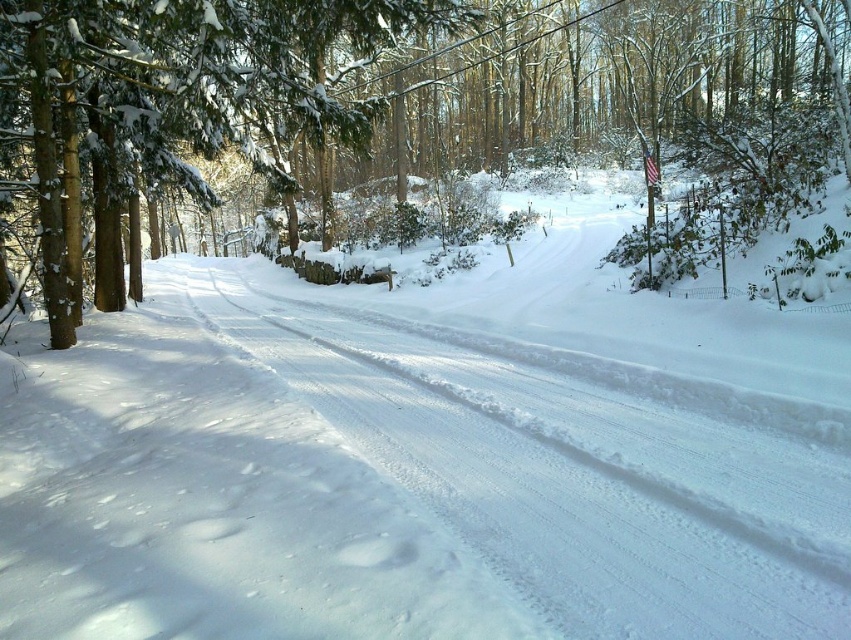
Who is positioned more to the left, white snow trail at center or snow-covered evergreen tree at left?

From the viewer's perspective, snow-covered evergreen tree at left appears more on the left side.

The width and height of the screenshot is (851, 640). Describe the element at coordinates (572, 477) in the screenshot. I see `white snow trail at center` at that location.

The image size is (851, 640). I want to click on white snow trail at center, so click(572, 477).